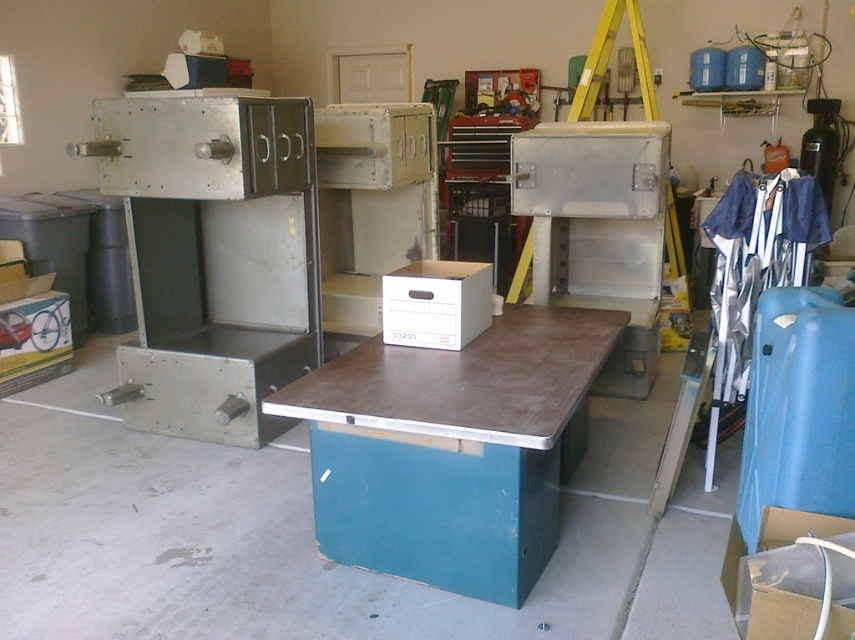
Question: Can you confirm if metallic gray machine at left is wider than cardboard box at lower right?

Choices:
 (A) no
 (B) yes

Answer: (B)

Question: Can you confirm if white cardboard box at center is bigger than cardboard box at lower right?

Choices:
 (A) no
 (B) yes

Answer: (A)

Question: Which of the following is the farthest from the observer?

Choices:
 (A) white cardboard box at center
 (B) metallic gray machine at left
 (C) brown/metallic table at center
 (D) cardboard box at lower right

Answer: (B)

Question: Does metallic gray machine at left have a larger size compared to white cardboard box at center?

Choices:
 (A) no
 (B) yes

Answer: (B)

Question: Which is farther from the white cardboard box at center?

Choices:
 (A) brown/metallic table at center
 (B) metallic gray machine at left
 (C) cardboard box at lower right

Answer: (C)

Question: Estimate the real-world distances between objects in this image. Which object is closer to the cardboard box at lower right?

Choices:
 (A) metallic gray machine at left
 (B) white cardboard box at center
 (C) brown/metallic table at center

Answer: (C)